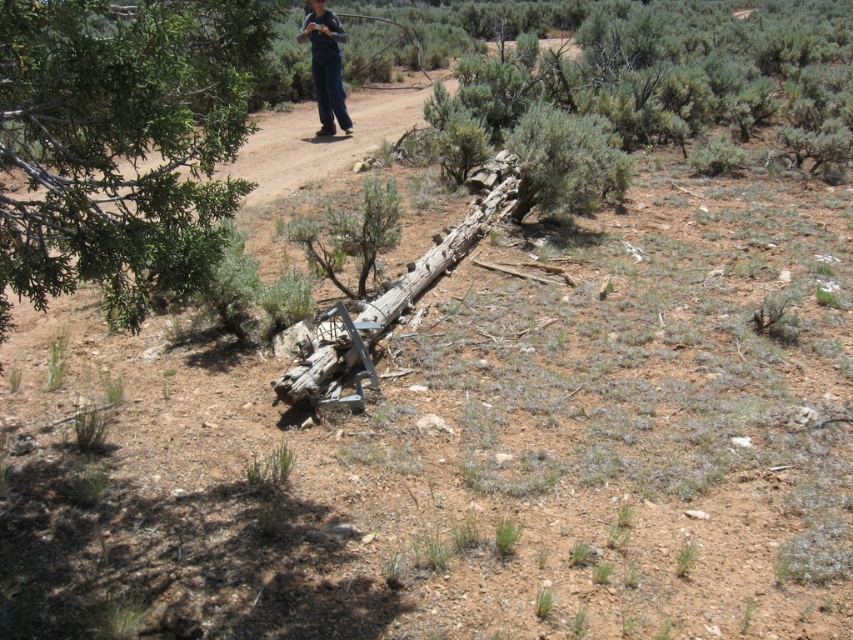
Which is more to the right, green leafy branch at upper left or dark blue jeans at upper center?

green leafy branch at upper left

Can you confirm if green leafy branch at upper left is positioned below dark blue jeans at upper center?

Correct, green leafy branch at upper left is located below dark blue jeans at upper center.

What do you see at coordinates (120, 144) in the screenshot? I see `green leafy branch at upper left` at bounding box center [120, 144].

Identify the location of green leafy branch at upper left. The height and width of the screenshot is (640, 853). (120, 144).